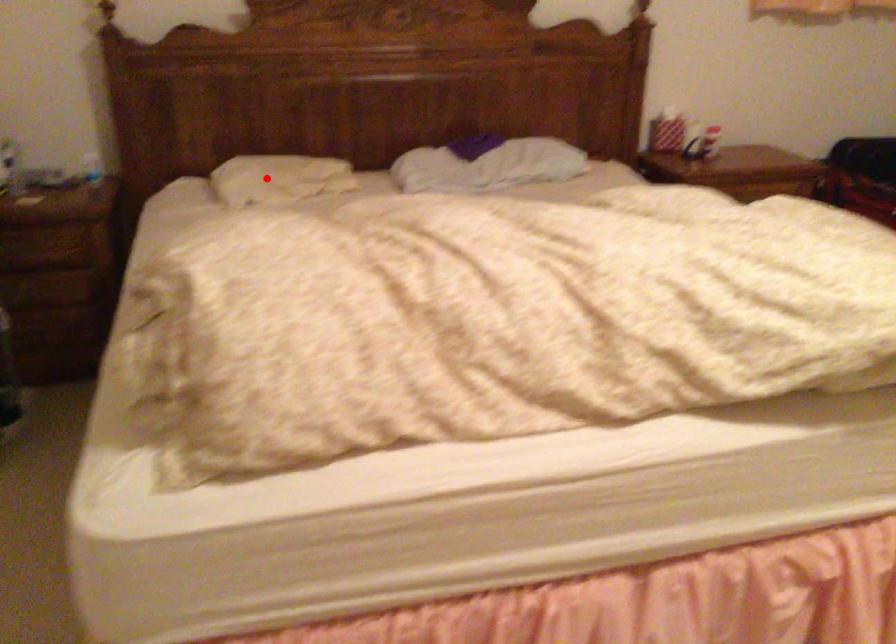
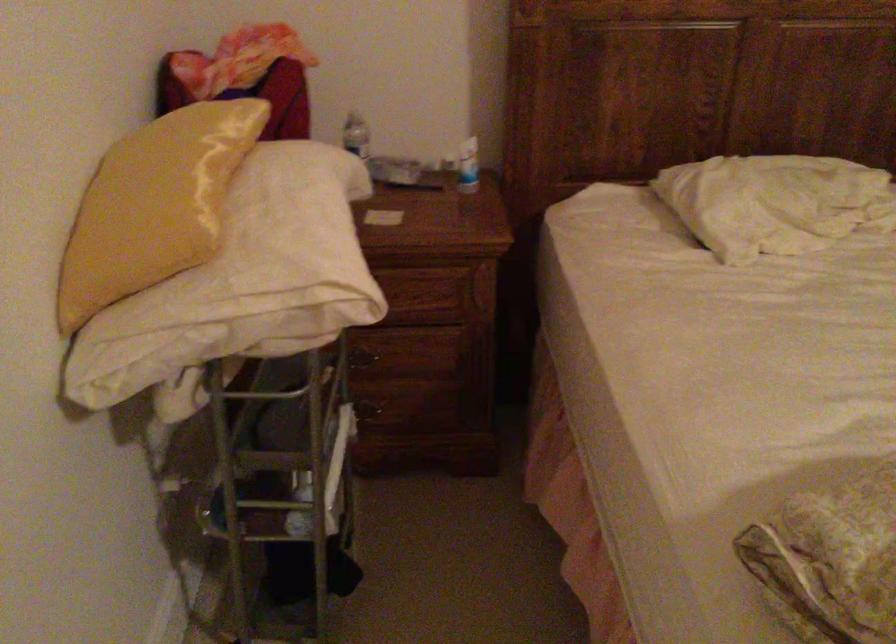
Locate, in the second image, the point that corresponds to the highlighted location in the first image.

(774, 202)